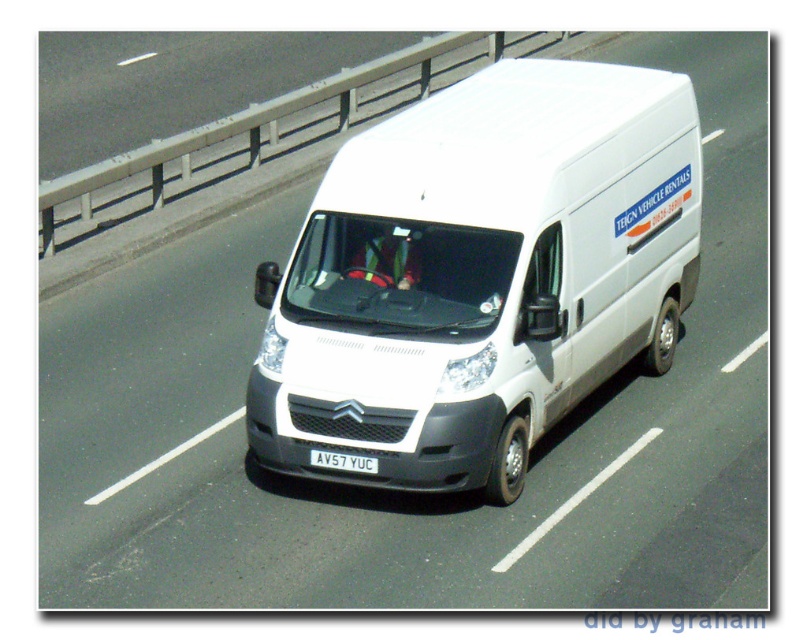
You are a delivery driver in a white matte van at center. You need to check your license plate to confirm the registration details. Can you reach the white plastic license plate at center from your current position without moving the van?

The white matte van at center is 5.96 feet from white plastic license plate at center. Since the license plate is attached to the van, you can reach it without moving the van.

You are a pedestrian standing on the sidewalk next to the road where the white matte van at center is driving. You want to cross the road to reach the bus stop on the other side. The white plastic license plate at center is partially blocking your view. Can you see the entire license plate from your current position?

The white matte van at center is larger in size than the white plastic license plate at center, so the van may be blocking part of the license plate from your view. However, since the license plate is at the center of the van, you might still see most of it unless the van is directly in front of you.